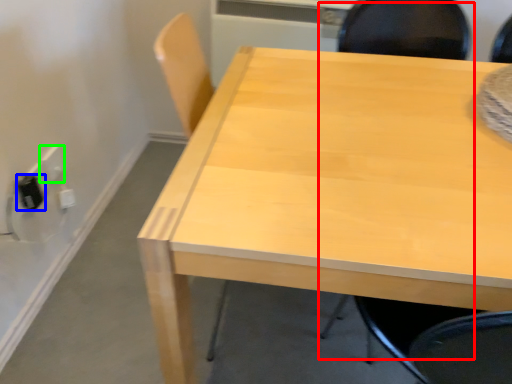
Question: Which object is the farthest from chair (highlighted by a red box)? Choose among these: electric outlet (highlighted by a blue box) or electric outlet (highlighted by a green box).

Choices:
 (A) electric outlet
 (B) electric outlet

Answer: (A)